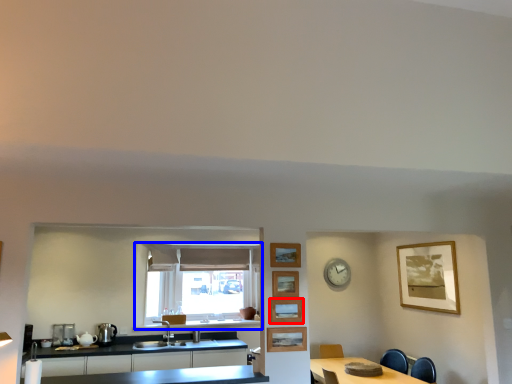
Question: Among these objects, which one is nearest to the camera, picture frame (highlighted by a red box) or window (highlighted by a blue box)?

Choices:
 (A) picture frame
 (B) window

Answer: (A)